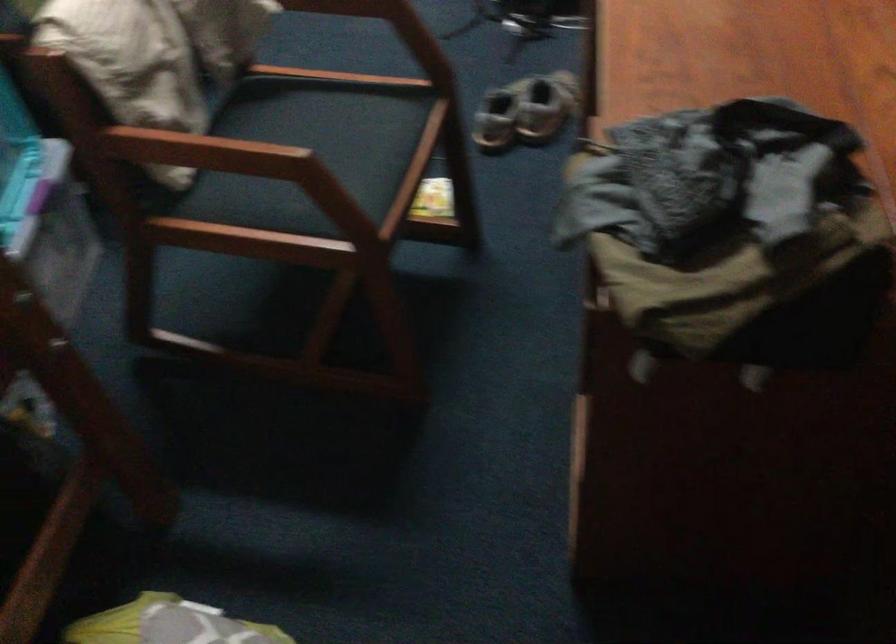
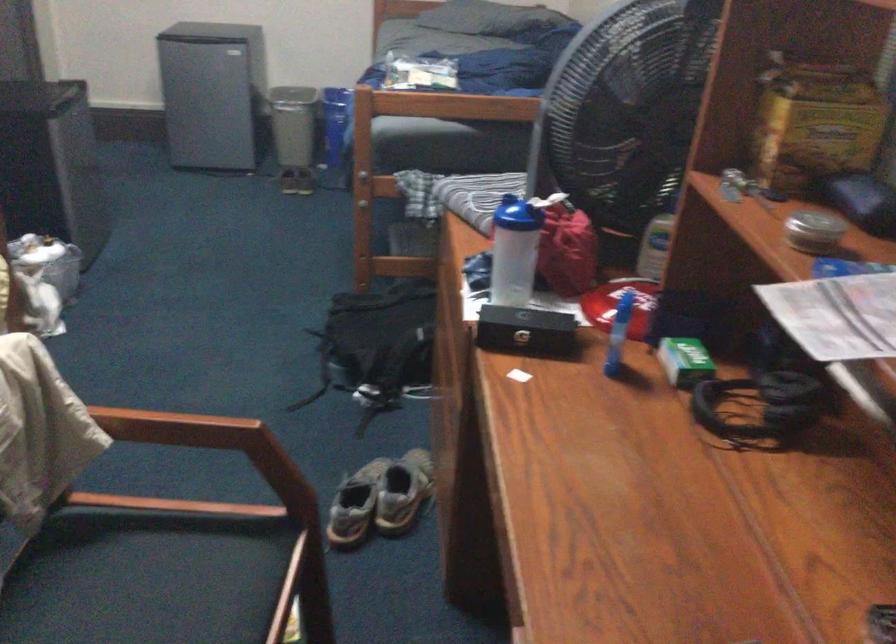
In the second image, find the point that corresponds to (326,129) in the first image.

(162, 579)